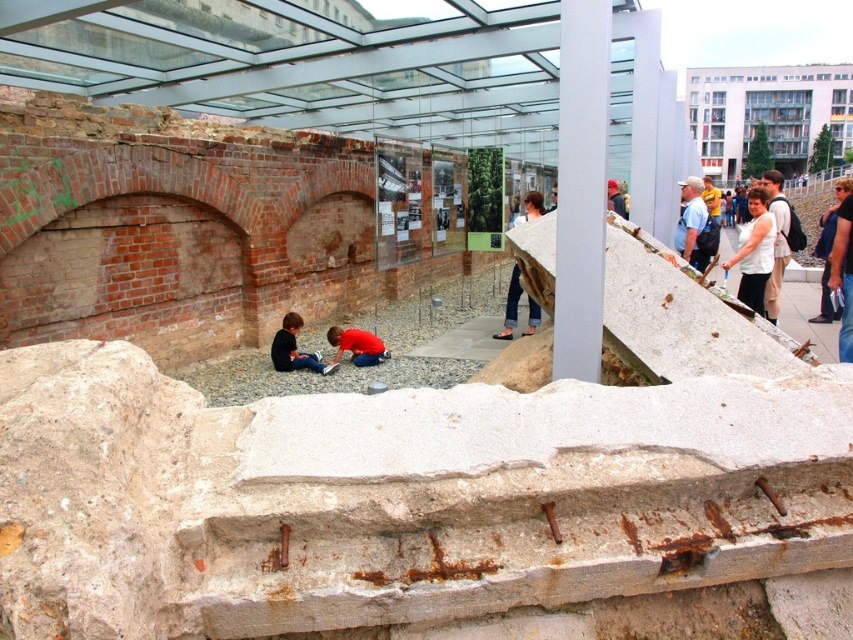
You are an archaeologist examining the site. You notice the white smooth pillar at upper center and the white matte shirt at center. Which object is wider?

The white matte shirt at center is wider than the white smooth pillar at upper center.

In the scene shown: You are an archaeologist standing at the entrance of the site. You notice a point marked at coordinates (581, 186). Based on the scene, where is this point located?

The point is located on the white smooth pillar at upper center.

You are an archaeologist examining the site. You notice a point marked at coordinates [581,186]. Based on the scene description, where is this point located?

The point at [581,186] is on the white smooth pillar at upper center.